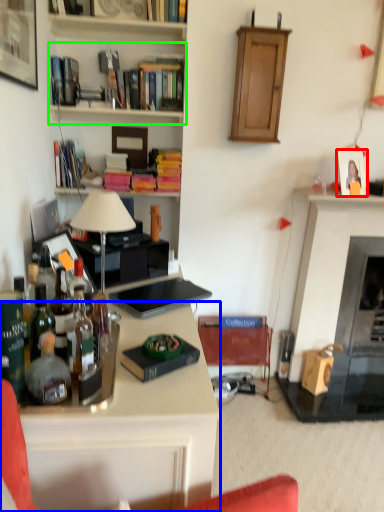
Question: Estimate the real-world distances between objects in this image. Which object is farther from picture frame (highlighted by a red box), desk (highlighted by a blue box) or shelf (highlighted by a green box)?

Choices:
 (A) desk
 (B) shelf

Answer: (A)